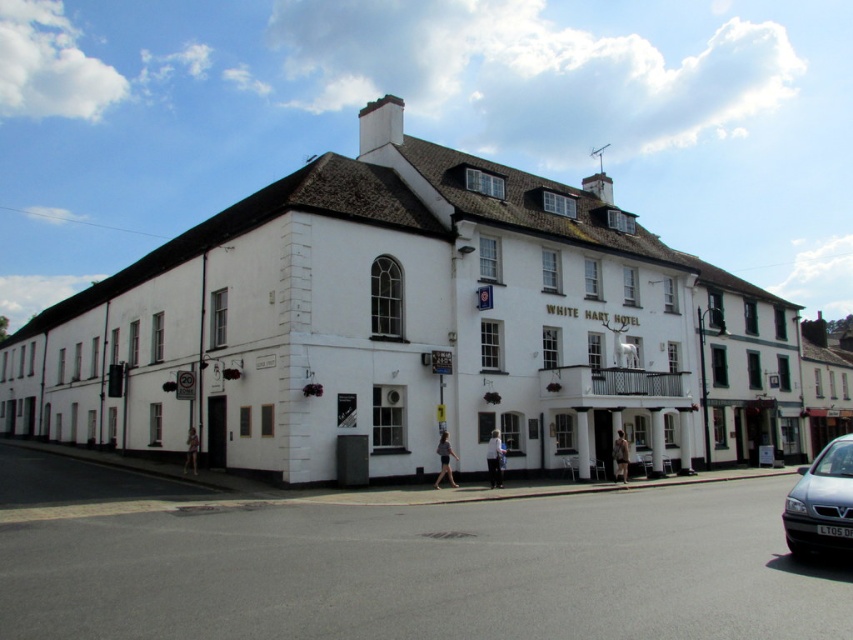
How much distance is there between white painted building at center and silver metallic van at lower right?

white painted building at center is 22.05 meters away from silver metallic van at lower right.

Is the position of white painted building at center more distant than that of silver metallic van at lower right?

Yes, white painted building at center is behind silver metallic van at lower right.

Image resolution: width=853 pixels, height=640 pixels. What do you see at coordinates (415, 330) in the screenshot? I see `white painted building at center` at bounding box center [415, 330].

I want to click on white painted building at center, so click(415, 330).